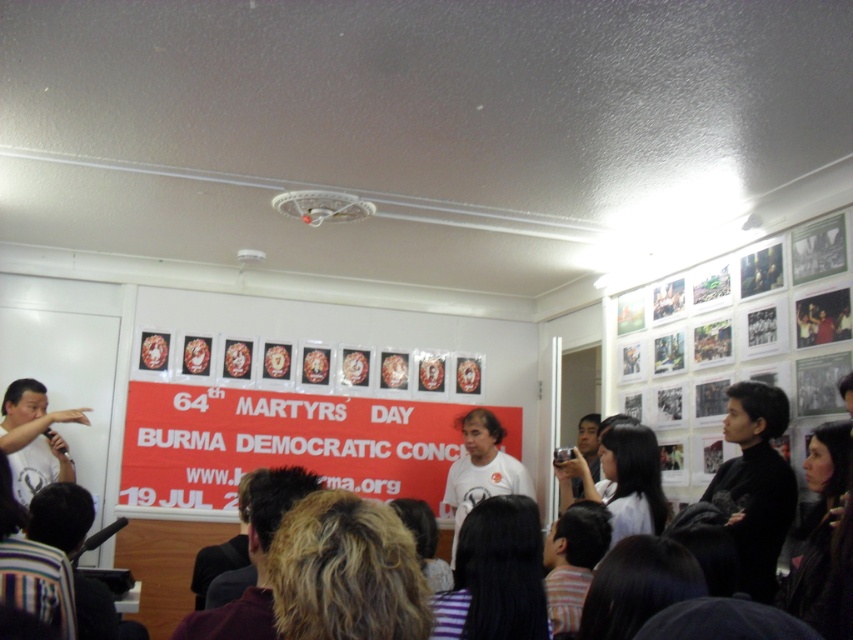
Is dark hair at center wider than matte white t-shirt at left?

Correct, the width of dark hair at center exceeds that of matte white t-shirt at left.

Is point (189, 529) positioned after point (19, 461)?

Yes, it is.

Between point (165, 554) and point (25, 474), which one is positioned in front?

Point (25, 474) is more forward.

This screenshot has height=640, width=853. In order to click on dark hair at center in this screenshot , I will do `click(164, 564)`.

Is dark hair at center positioned before white matte t-shirt at center?

Yes, it is.

Is dark hair at center above white matte t-shirt at center?

No.

The height and width of the screenshot is (640, 853). I want to click on dark hair at center, so click(164, 564).

Which is below, matte white t-shirt at left or white matte t-shirt at center?

white matte t-shirt at center

Does matte white t-shirt at left appear over white matte t-shirt at center?

Indeed, matte white t-shirt at left is positioned over white matte t-shirt at center.

Who is more distant from viewer, (54, 467) or (503, 484)?

Positioned behind is point (503, 484).

You are a GUI agent. You are given a task and a screenshot of the screen. Output one action in this format:
    pyautogui.click(x=<x>, y=<y>)
    Task: Click on the matte white t-shirt at left
    
    Given the screenshot: What is the action you would take?
    pyautogui.click(x=33, y=438)